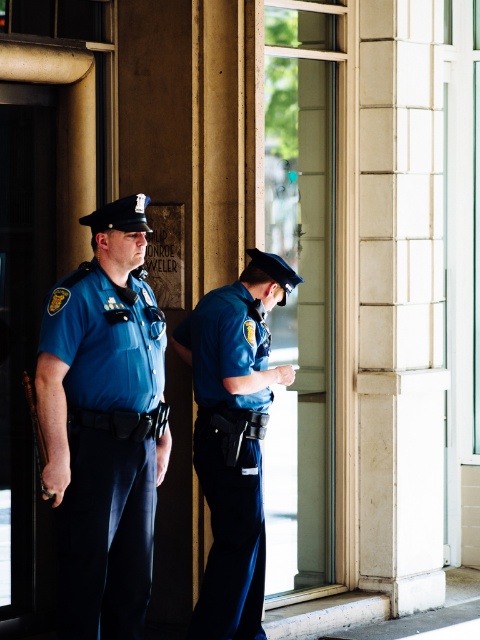
Between point (382, 390) and point (80, 580), which one is positioned behind?

Positioned behind is point (382, 390).

Does white marble pillar at right appear under matte blue uniform at left?

No.

Between point (391, 570) and point (130, 429), which one is positioned in front?

Point (130, 429) is more forward.

Locate an element on the screen. Image resolution: width=480 pixels, height=640 pixels. white marble pillar at right is located at coordinates (400, 301).

Is matte blue uniform at left to the right of blue uniform at right from the viewer's perspective?

In fact, matte blue uniform at left is to the left of blue uniform at right.

Who is higher up, matte blue uniform at left or blue uniform at right?

Positioned higher is matte blue uniform at left.

Where is `matte blue uniform at left`? matte blue uniform at left is located at coordinates (106, 449).

Locate an element on the screen. matte blue uniform at left is located at coordinates pyautogui.click(x=106, y=449).

Does white marble pillar at right lie behind blue uniform at right?

Yes, it is.

Who is more forward, (360,406) or (229,358)?

Positioned in front is point (229,358).

You are a GUI agent. You are given a task and a screenshot of the screen. Output one action in this format:
    pyautogui.click(x=<x>, y=<y>)
    Task: Click on the white marble pillar at right
    
    Given the screenshot: What is the action you would take?
    pyautogui.click(x=400, y=301)